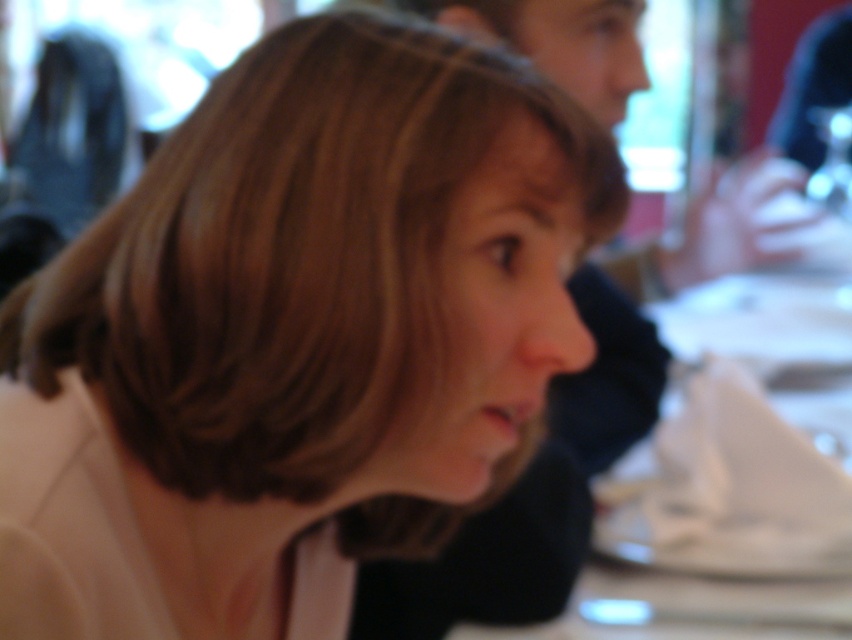
You are a photographer at a social event. You want to take a photo of the smooth beige hair at center and the white fabric table at center. Can you fit both subjects in the frame if your camera has a 12 inch field of view?

The smooth beige hair at center is 21.58 inches from white fabric table at center. Since the distance between them exceeds the camera field of view of 12 inches, you cannot fit both subjects in the frame.

You are a photographer trying to capture a closeup of the smooth beige hair at center and the white fabric table at center. Which object would appear narrower in your photo?

The smooth beige hair at center is thinner than the white fabric table at center, so it would appear narrower in the photo.